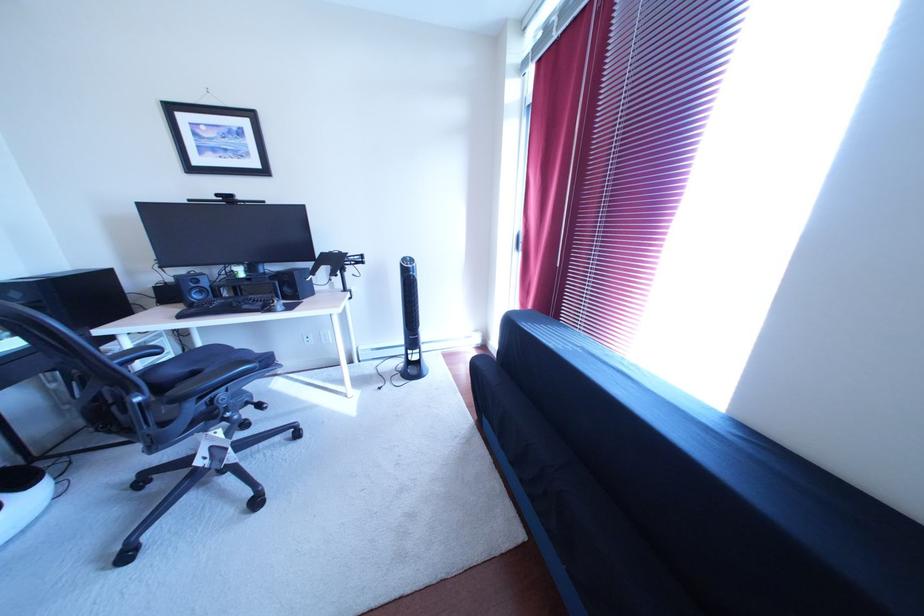
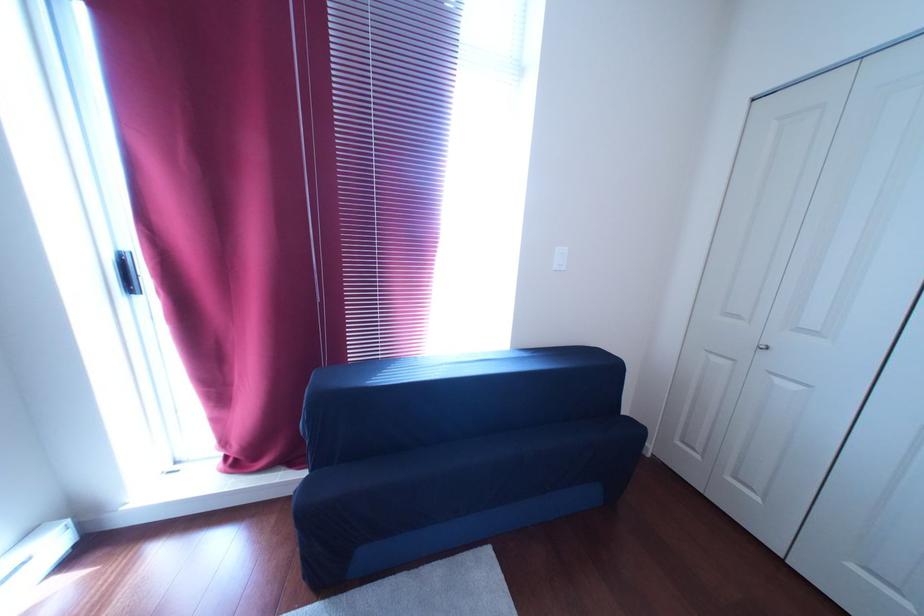
Question: The first image is from the beginning of the video and the second image is from the end. How did the camera likely rotate when shooting the video?

Choices:
 (A) Left
 (B) Right
 (C) Up
 (D) Down

Answer: (B)